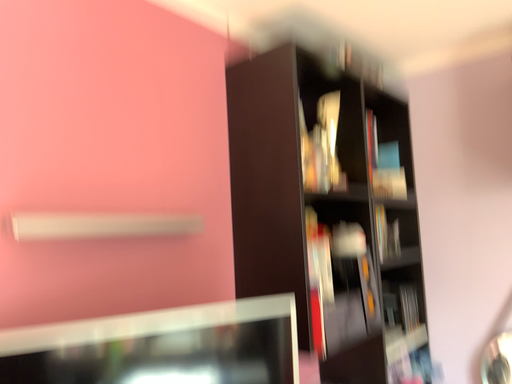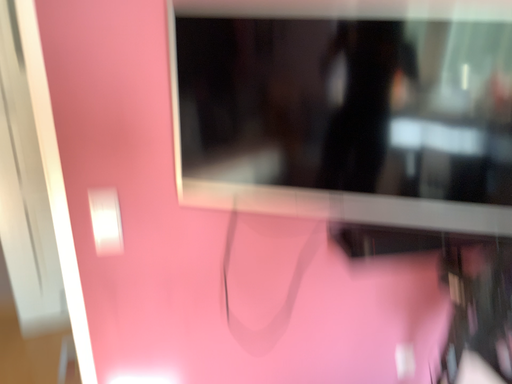
Question: How did the camera likely rotate when shooting the video?

Choices:
 (A) rotated left
 (B) rotated right

Answer: (A)